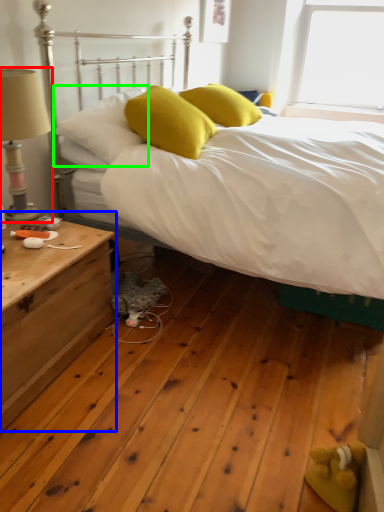
Question: Which is farther away from table lamp (highlighted by a red box)? nightstand (highlighted by a blue box) or pillow (highlighted by a green box)?

Choices:
 (A) nightstand
 (B) pillow

Answer: (A)